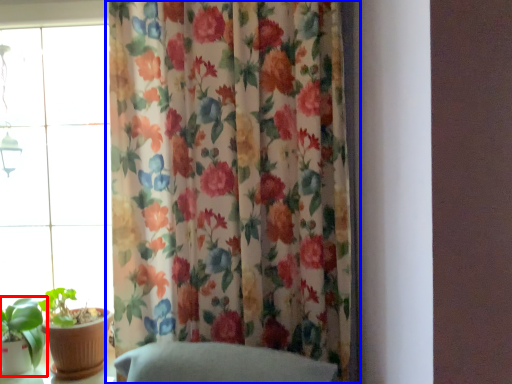
Question: Which object is further to the camera taking this photo, houseplant (highlighted by a red box) or curtain (highlighted by a blue box)?

Choices:
 (A) houseplant
 (B) curtain

Answer: (A)